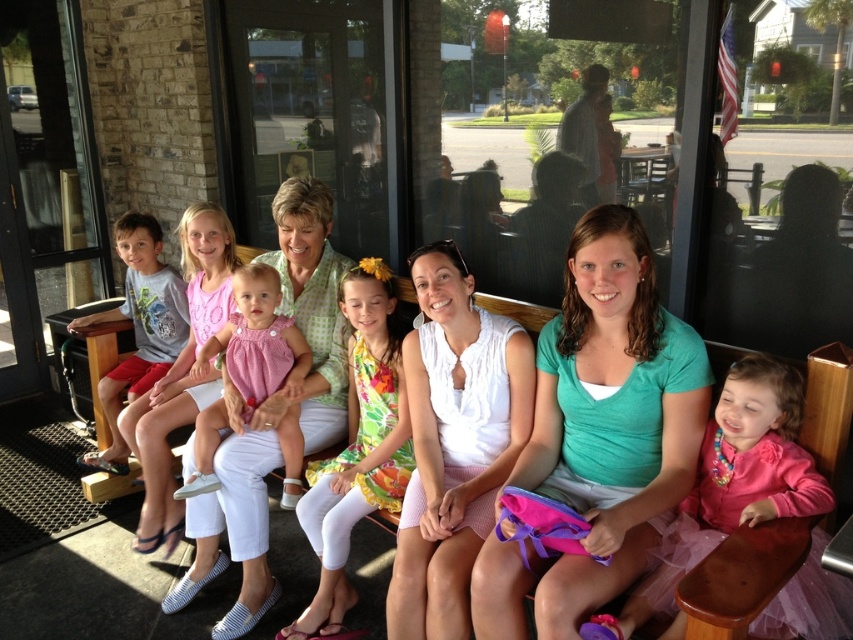
You are a photographer trying to capture a group photo of the teal satin shirt at center and the pink fabric dress at center. Since you want to ensure both are clearly visible, which one should you focus on first to account for their sizes?

The teal satin shirt at center is taller than the pink fabric dress at center, so you should focus on the teal satin shirt at center first to ensure its details are captured clearly before adjusting for the smaller pink fabric dress at center.

You are standing in front of the wooden bench where the group is seated. You need to locate the teal satin shirt at center. Based on the coordinates provided, can you determine its position relative to the bench?

The teal satin shirt at center is located at coordinates point (601, 432), which places it near the middle of the bench.

You are a photographer trying to capture a group photo of the teal satin shirt at center and the floral dress at center. Which one should you focus on first if you want to include both in the frame without moving the camera?

The teal satin shirt at center is larger in size than the floral dress at center, so you should focus on the teal satin shirt at center first as it occupies more space in the frame.